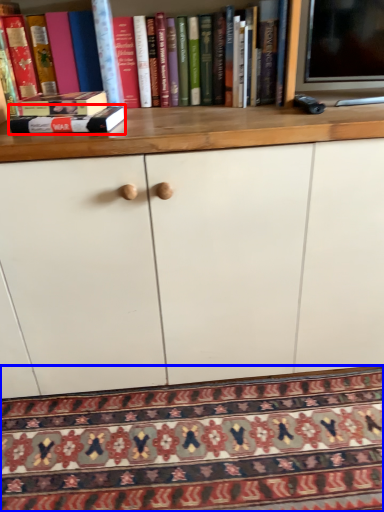
Question: Among these objects, which one is farthest to the camera, book (highlighted by a red box) or mat (highlighted by a blue box)?

Choices:
 (A) book
 (B) mat

Answer: (A)